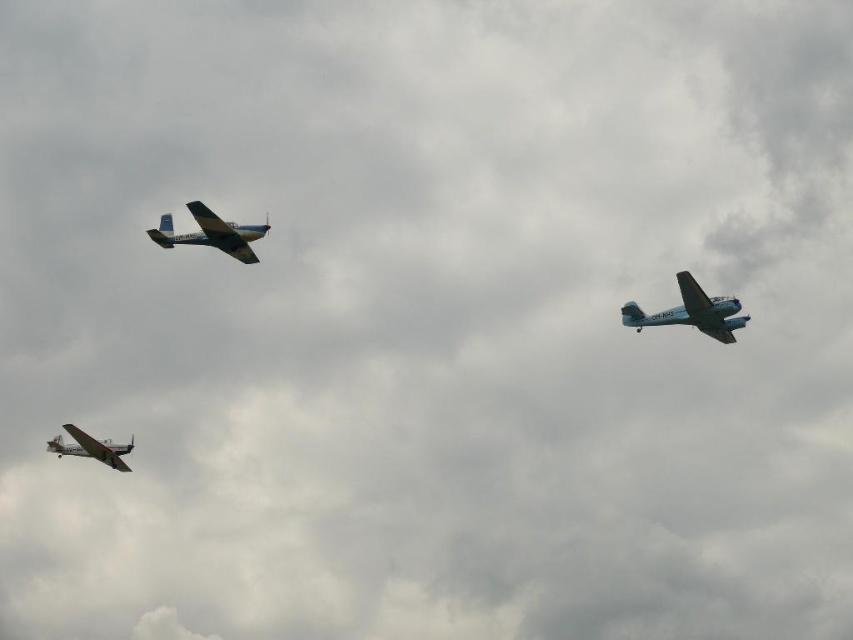
Question: Among these objects, which one is farthest from the camera?

Choices:
 (A) light blue matte airplane at upper right
 (B) metallic blue airplane at upper left

Answer: (B)

Question: Which point is closer to the camera taking this photo?

Choices:
 (A) (189, 234)
 (B) (91, 449)

Answer: (A)

Question: Is metallic blue airplane at upper left below silver metallic airplane at lower left?

Choices:
 (A) no
 (B) yes

Answer: (A)

Question: Can you confirm if light blue matte airplane at upper right is positioned above silver metallic airplane at lower left?

Choices:
 (A) yes
 (B) no

Answer: (A)

Question: Is light blue matte airplane at upper right bigger than silver metallic airplane at lower left?

Choices:
 (A) no
 (B) yes

Answer: (B)

Question: Which is farther from the metallic blue airplane at upper left?

Choices:
 (A) light blue matte airplane at upper right
 (B) silver metallic airplane at lower left

Answer: (A)